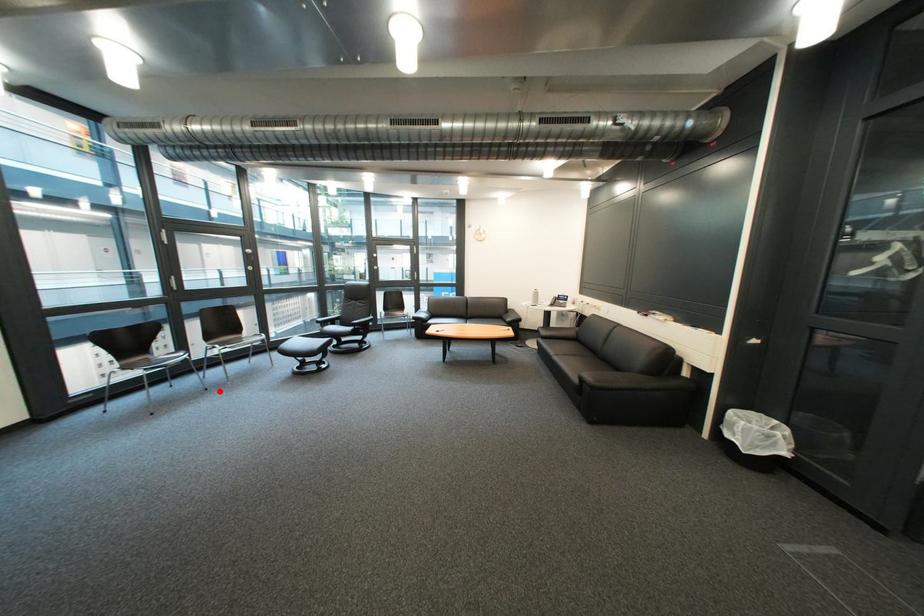
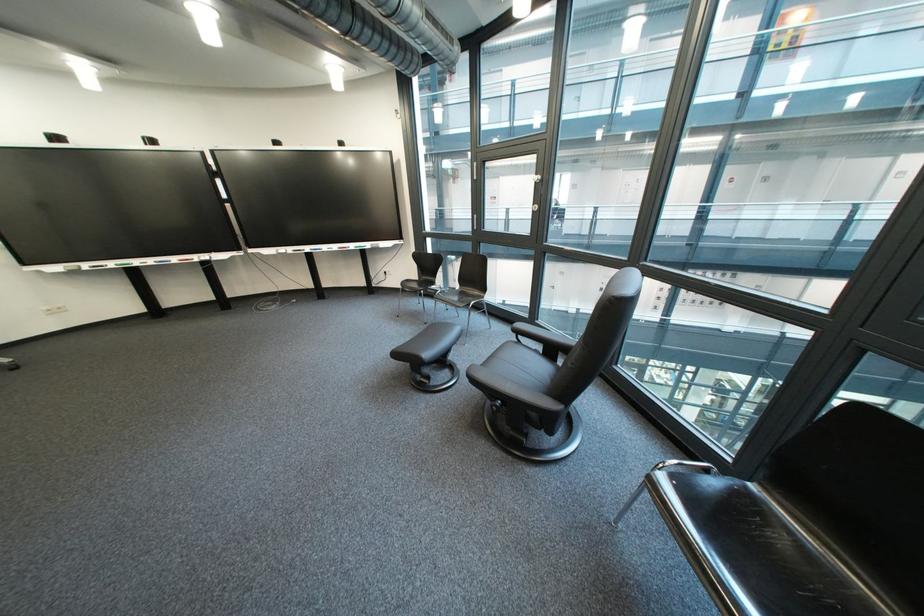
Question: I am providing you with two images of the same scene from different viewpoints. Image1 has a red point marked. In image2, the corresponding 3D location appears at what relative position? Reply with the corresponding letter.

Choices:
 (A) Closer
 (B) Farther

Answer: (B)